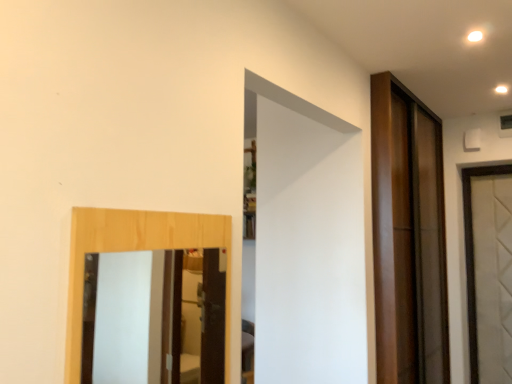
Question: From the image's perspective, is wooden-framed mirror at left above or below shiny brown door at right?

Choices:
 (A) below
 (B) above

Answer: (B)

Question: Considering the relative positions of wooden-framed mirror at left and shiny brown door at right in the image provided, is wooden-framed mirror at left to the left or to the right of shiny brown door at right?

Choices:
 (A) right
 (B) left

Answer: (B)

Question: Which is correct: wooden-framed mirror at left is inside shiny brown door at right, or outside of it?

Choices:
 (A) outside
 (B) inside

Answer: (A)

Question: Visually, is shiny brown door at right positioned to the left or to the right of wooden-framed mirror at left?

Choices:
 (A) left
 (B) right

Answer: (B)

Question: From a real-world perspective, is shiny brown door at right positioned above or below wooden-framed mirror at left?

Choices:
 (A) above
 (B) below

Answer: (A)

Question: Is shiny brown door at right taller or shorter than wooden-framed mirror at left?

Choices:
 (A) short
 (B) tall

Answer: (B)

Question: In the image, is shiny brown door at right positioned in front of or behind wooden-framed mirror at left?

Choices:
 (A) behind
 (B) front

Answer: (A)